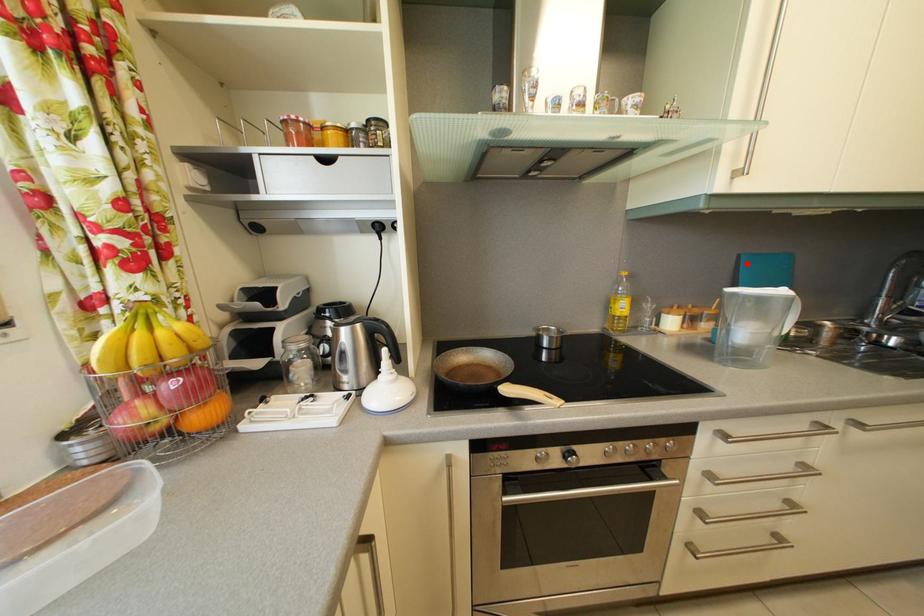
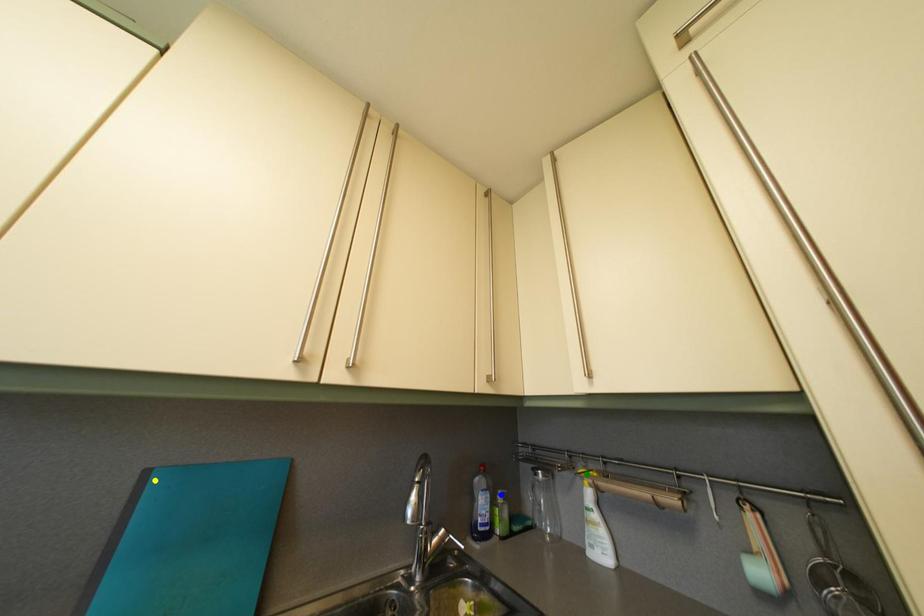
Question: I am providing you with two images of the same scene from different viewpoints. A red point is marked on the first image. You are given multiple points on the second image. Which point in image 2 is actually the same real-world point as the red point in image 1?

Choices:
 (A) green point
 (B) yellow point
 (C) blue point

Answer: (B)